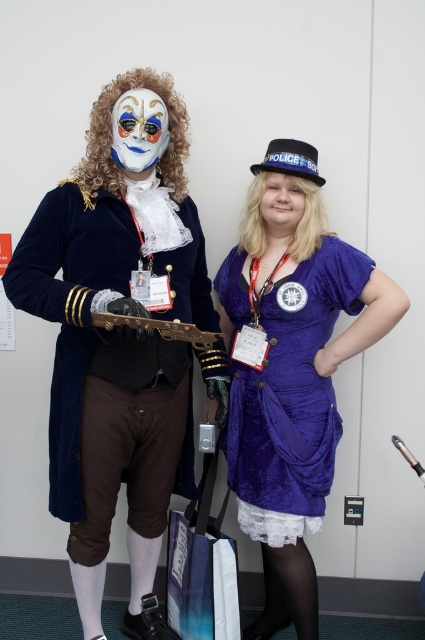
You are a photographer at a convention and need to capture both the velvet purple dress at center and the historical costume on the left in a single shot. Given their distance, will you need to adjust your camera to a wider angle to include both?

The velvet purple dress at center and the historical costume on the left are 5.90 feet apart. To capture both in a single shot, you would need to adjust your camera to a wider angle to accommodate the distance between them.

You are at a convention and need to find the velvet purple dress at center. According to the scene description, where should you look relative to the other person?

The velvet purple dress at center is located at point coordinates, so you should look towards the center area of the image where the coordinates indicate its position relative to the other person.

You are a photographer at a costume event and need to position the velvet purple dress at center and the velvet blue coat at center so that both fit within a 3 meter wide frame. Based on their widths, can both be placed side by side without overlapping?

The velvet purple dress at center might be wider than the velvet blue coat at center, so there is uncertainty about whether they can fit side by side within the 3 meter frame without overlapping. The photographer should measure both to confirm.